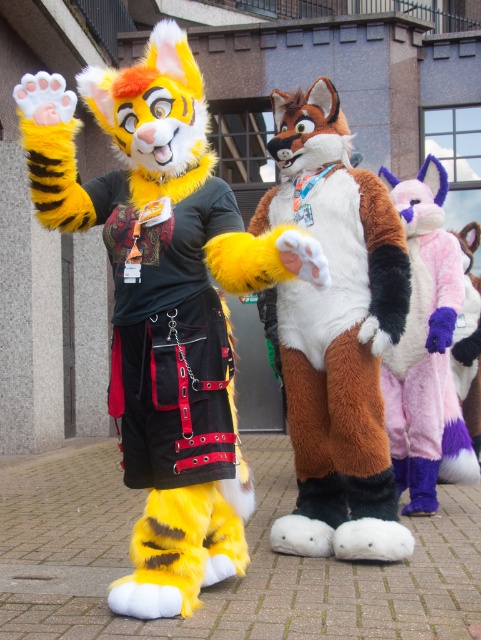
Question: Among these points, which one is farthest from the camera?

Choices:
 (A) (464, 381)
 (B) (42, 125)

Answer: (A)

Question: Does fluffy fur skirt at center have a smaller size compared to purple fuzzy costume at right?

Choices:
 (A) no
 (B) yes

Answer: (B)

Question: Which object appears farthest from the camera in this image?

Choices:
 (A) purple fuzzy costume at right
 (B) purple fuzzy coat at right

Answer: (B)

Question: Can you confirm if brown fuzzy fox at center is smaller than fluffy fur skirt at center?

Choices:
 (A) yes
 (B) no

Answer: (B)

Question: Considering the real-world distances, which object is farthest from the fluffy fur skirt at center?

Choices:
 (A) purple fuzzy costume at right
 (B) fluffy yellow fur at center
 (C) brown fuzzy fox at center
 (D) purple fuzzy coat at right

Answer: (D)

Question: Is brown fuzzy fox at center behind fluffy fur skirt at center?

Choices:
 (A) no
 (B) yes

Answer: (B)